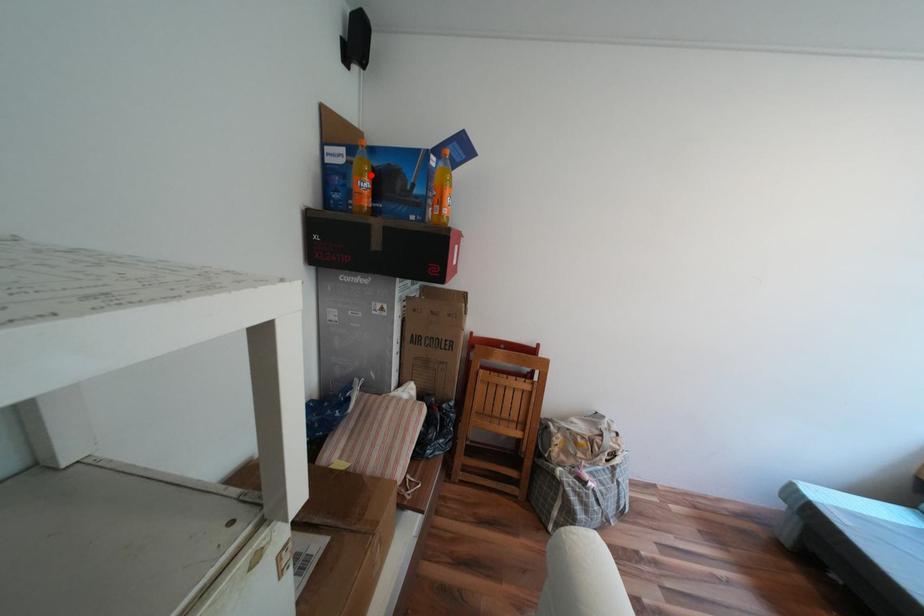
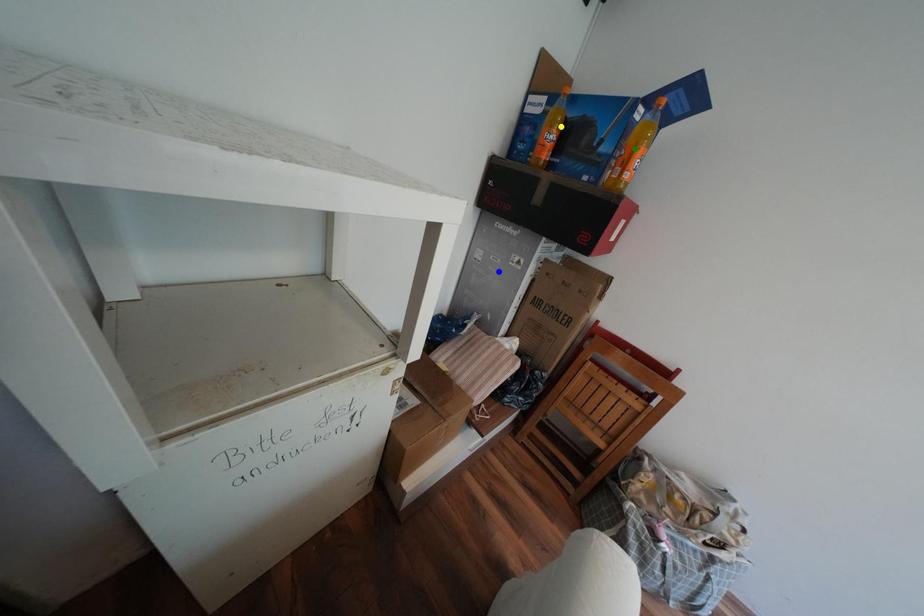
Question: I am providing you with two images of the same scene from different viewpoints. A red point is marked on the first image. You are given multiple points on the second image. Can you choose the point in image 2 that corresponds to the point in image 1?

Choices:
 (A) yellow point
 (B) blue point
 (C) green point

Answer: (A)